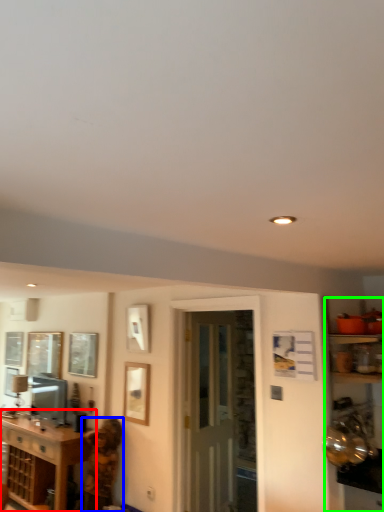
Question: Considering the real-world distances, which object is closest to cabinetry (highlighted by a red box)? person (highlighted by a blue box) or entertainment center (highlighted by a green box).

Choices:
 (A) person
 (B) entertainment center

Answer: (A)